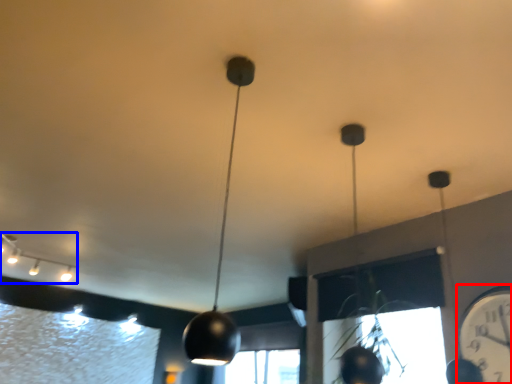
Question: Which object appears farthest to the camera in this image, clock (highlighted by a red box) or lamp (highlighted by a blue box)?

Choices:
 (A) clock
 (B) lamp

Answer: (B)